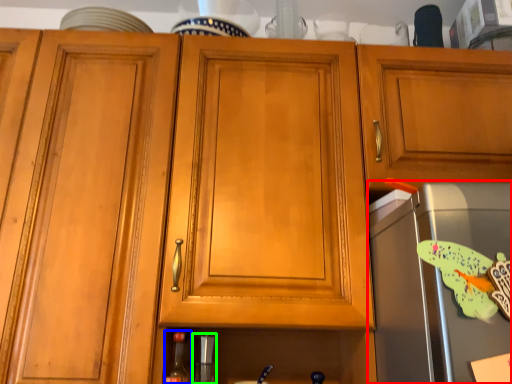
Question: Which object is the farthest from appliance (highlighted by a red box)? Choose among these: bottle (highlighted by a blue box) or appliance (highlighted by a green box).

Choices:
 (A) bottle
 (B) appliance

Answer: (A)